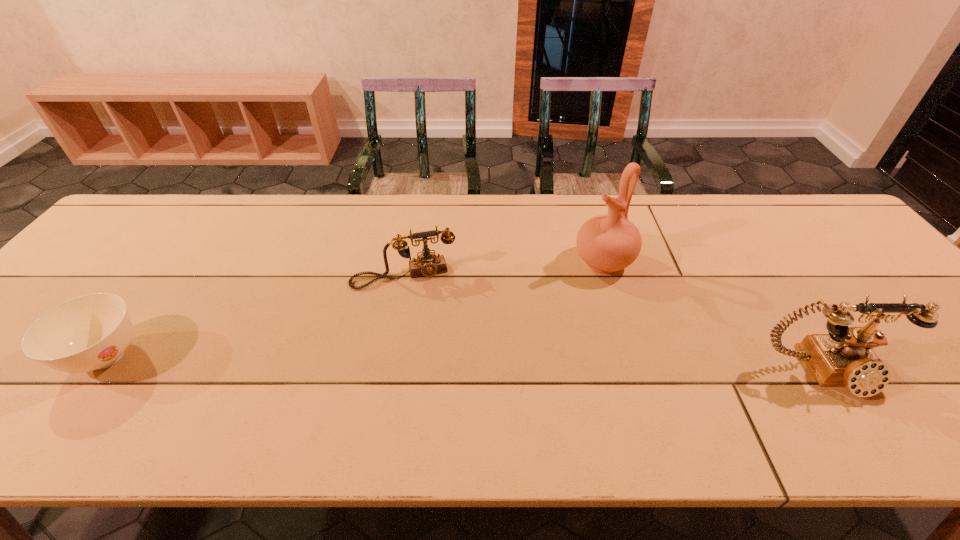
Where is `sugar bowl`? sugar bowl is located at coordinates (91, 332).

The image size is (960, 540). Identify the location of the shortest object. (91, 332).

You are a GUI agent. You are given a task and a screenshot of the screen. Output one action in this format:
    pyautogui.click(x=<x>, y=<y>)
    Task: Click on the rightmost object
    This screenshot has width=960, height=540.
    Given the screenshot: What is the action you would take?
    pyautogui.click(x=843, y=358)

Locate an element on the screen. The width and height of the screenshot is (960, 540). the right telephone is located at coordinates (843, 358).

Identify the location of the tallest object. (608, 243).

Locate an element on the screen. The image size is (960, 540). pottery is located at coordinates (608, 243).

Where is `the third object from right to left`? Image resolution: width=960 pixels, height=540 pixels. the third object from right to left is located at coordinates (427, 264).

Where is `the third tallest object`? The height and width of the screenshot is (540, 960). the third tallest object is located at coordinates (427, 264).

Locate an element on the screen. This screenshot has width=960, height=540. vacant area located on the right of the shortest object is located at coordinates (232, 357).

At what (x,y) coordinates should I click in order to perform the action: click on vacant space located 0.240m on the spout of the third object from left to right. Please return your answer as a coordinate pair (x, y). The image size is (960, 540). Looking at the image, I should click on (527, 326).